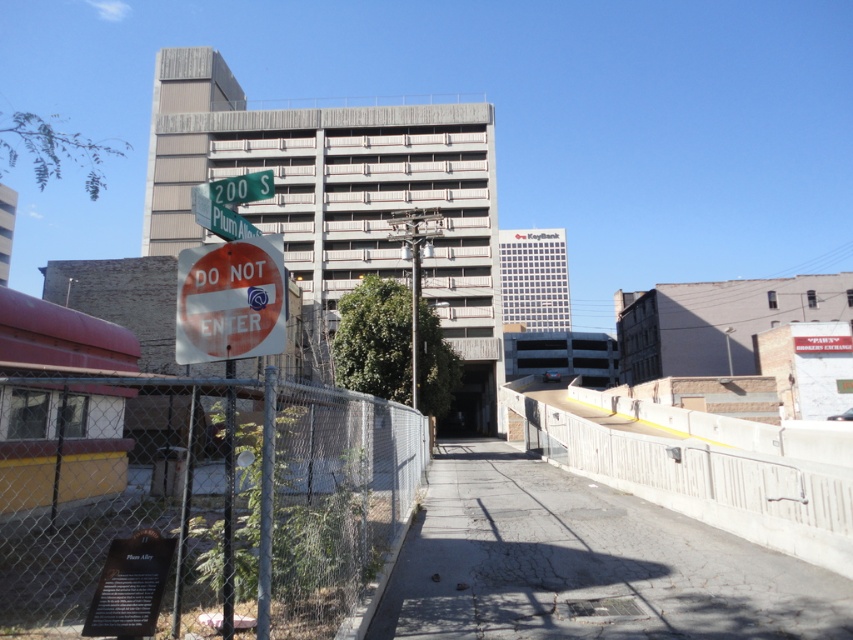
Which is below, chain link fence at lower left or green metallic street sign at upper center?

chain link fence at lower left

What do you see at coordinates (206, 515) in the screenshot? I see `chain link fence at lower left` at bounding box center [206, 515].

Who is more forward, (207, 561) or (247, 234)?

Point (247, 234) is more forward.

This screenshot has height=640, width=853. Find the location of `chain link fence at lower left`. chain link fence at lower left is located at coordinates (206, 515).

I want to click on red matte sign at center, so click(230, 300).

Is red matte sign at center positioned behind green metallic street sign at upper center?

No, it is not.

Who is more forward, (222, 294) or (200, 202)?

Positioned in front is point (222, 294).

The width and height of the screenshot is (853, 640). I want to click on red matte sign at center, so click(x=230, y=300).

Between chain link fence at lower left and concrete at center, which one is positioned lower?

concrete at center

Does chain link fence at lower left lie in front of concrete at center?

Yes, it is in front of concrete at center.

Which is behind, point (364, 438) or point (848, 448)?

The point (848, 448) is behind.

Locate an element on the screen. The height and width of the screenshot is (640, 853). chain link fence at lower left is located at coordinates (206, 515).